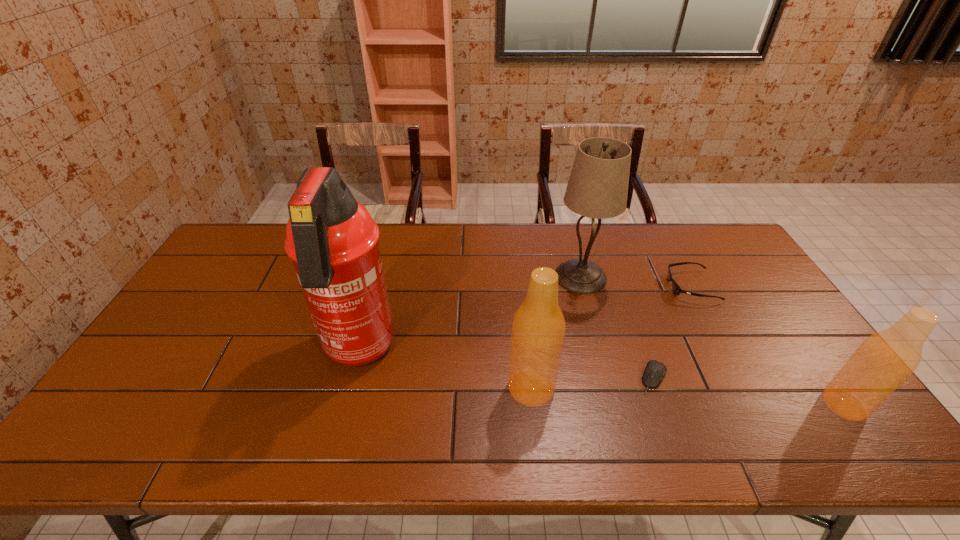
In the current image, all beer bottles are evenly spaced. To maintain this equal spacing, where should an additional beer bottle be placed on the left? Please point out a free spot. Please provide its 2D coordinates. Your answer should be formatted as a tuple, i.e. [(x, y)], where the tuple contains the x and y coordinates of a point satisfying the conditions above.

[(238, 373)]